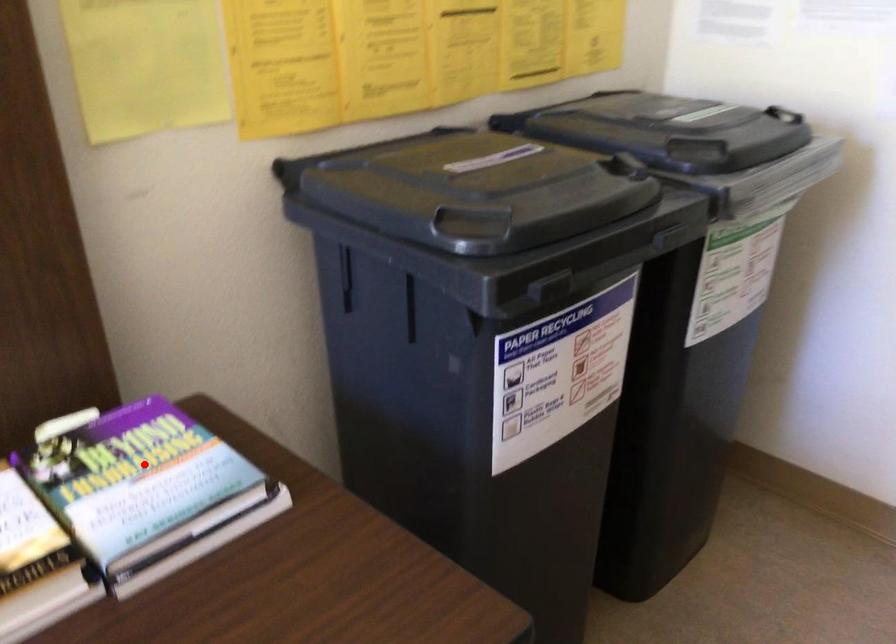
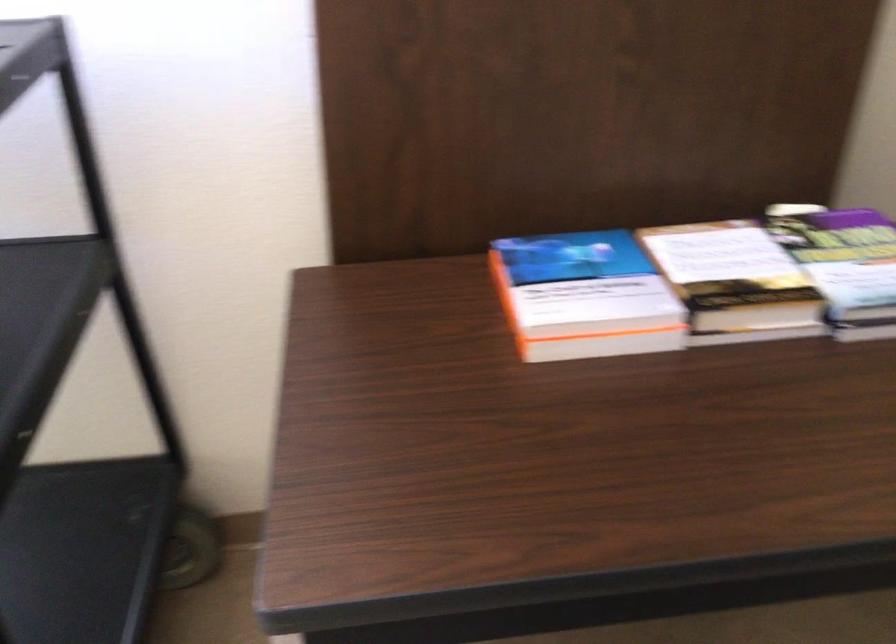
Find the pixel in the second image that matches the highlighted location in the first image.

(847, 260)